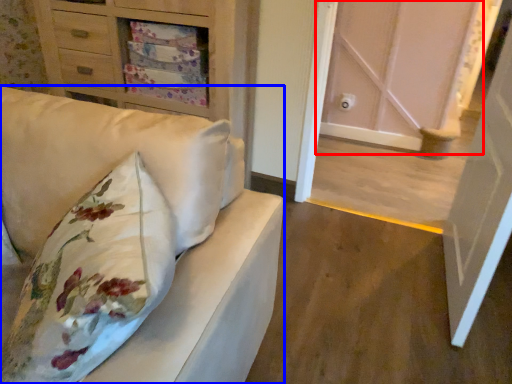
Question: Which object appears closest to the camera in this image, door (highlighted by a red box) or furniture (highlighted by a blue box)?

Choices:
 (A) door
 (B) furniture

Answer: (B)